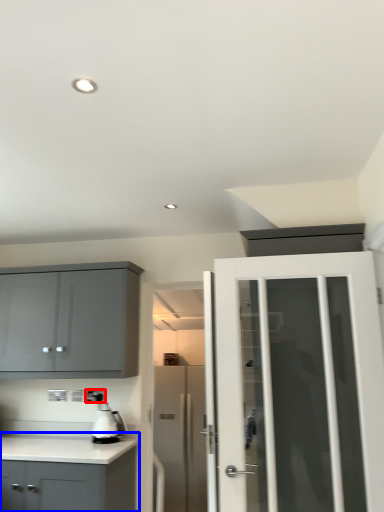
Question: Among these objects, which one is nearest to the camera, electric outlet (highlighted by a red box) or cabinetry (highlighted by a blue box)?

Choices:
 (A) electric outlet
 (B) cabinetry

Answer: (B)